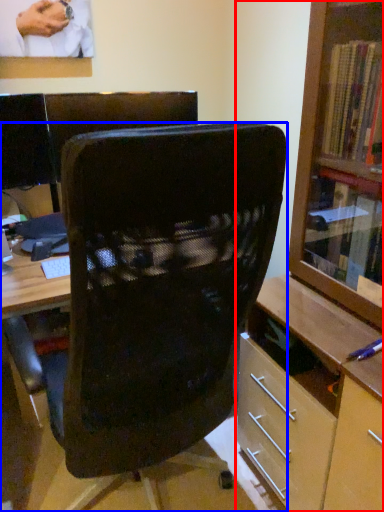
Question: Which object is closer to the camera taking this photo, shelf (highlighted by a red box) or chair (highlighted by a blue box)?

Choices:
 (A) shelf
 (B) chair

Answer: (A)